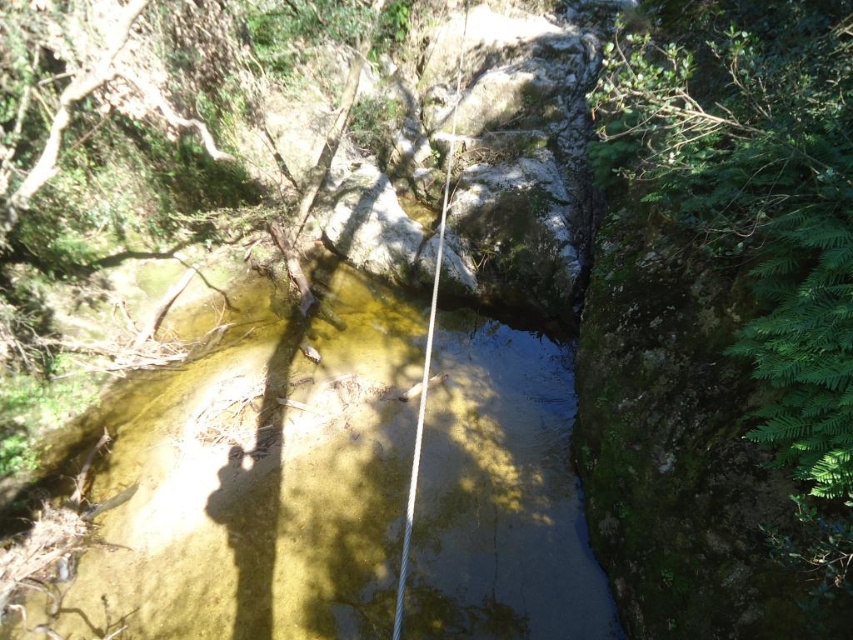
Who is taller, translucent yellowish water at center or green mossy rock at right?

Standing taller between the two is green mossy rock at right.

Is point (393, 362) closer to viewer compared to point (775, 148)?

No, (393, 362) is behind (775, 148).

Does point (206, 582) lie in front of point (699, 125)?

No.

Where is `translucent yellowish water at center`? translucent yellowish water at center is located at coordinates (259, 480).

Between green mossy rock at right and white rope at center, which one appears on the left side from the viewer's perspective?

Positioned to the left is white rope at center.

Is green mossy rock at right to the left of white rope at center from the viewer's perspective?

In fact, green mossy rock at right is to the right of white rope at center.

The width and height of the screenshot is (853, 640). Find the location of `green mossy rock at right`. green mossy rock at right is located at coordinates point(755,189).

Is translucent yellowish water at center further to camera compared to white rope at center?

Yes.

Is point (502, 513) positioned behind point (434, 296)?

That is True.

Measure the distance between translucent yellowish water at center and camera.

translucent yellowish water at center is 5.23 meters away from camera.

Where is `translucent yellowish water at center`? This screenshot has width=853, height=640. translucent yellowish water at center is located at coordinates (259, 480).